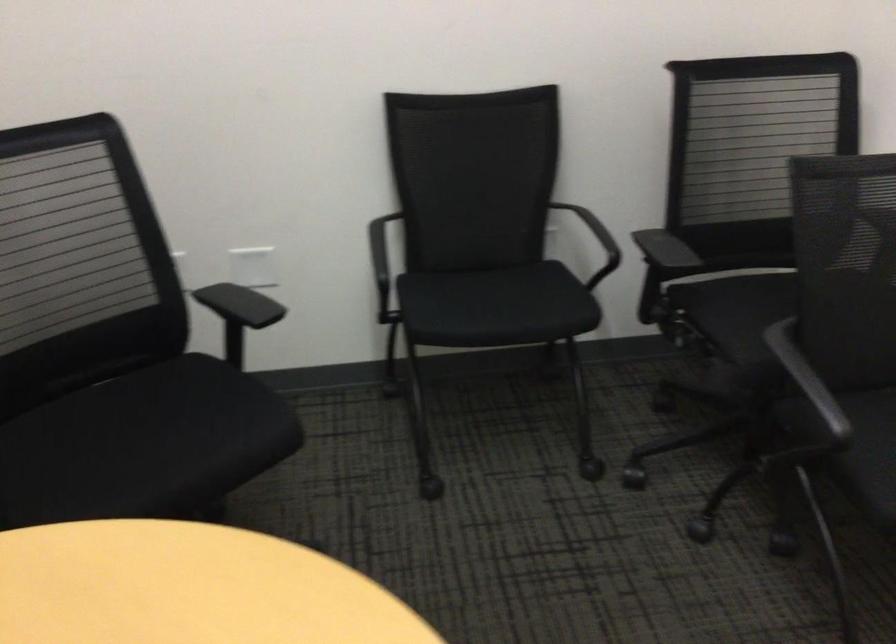
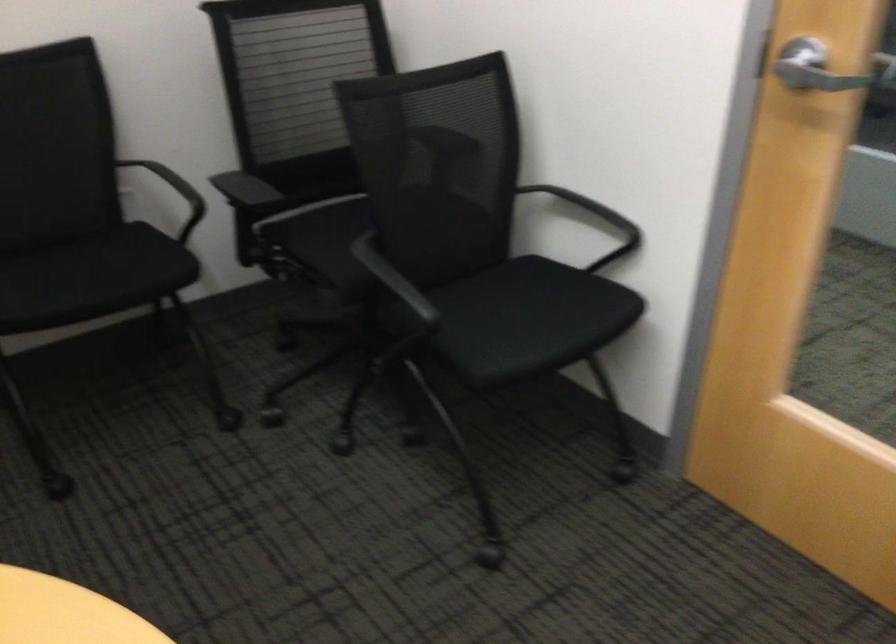
Locate, in the second image, the point that corresponds to [590,232] in the first image.

(174, 192)